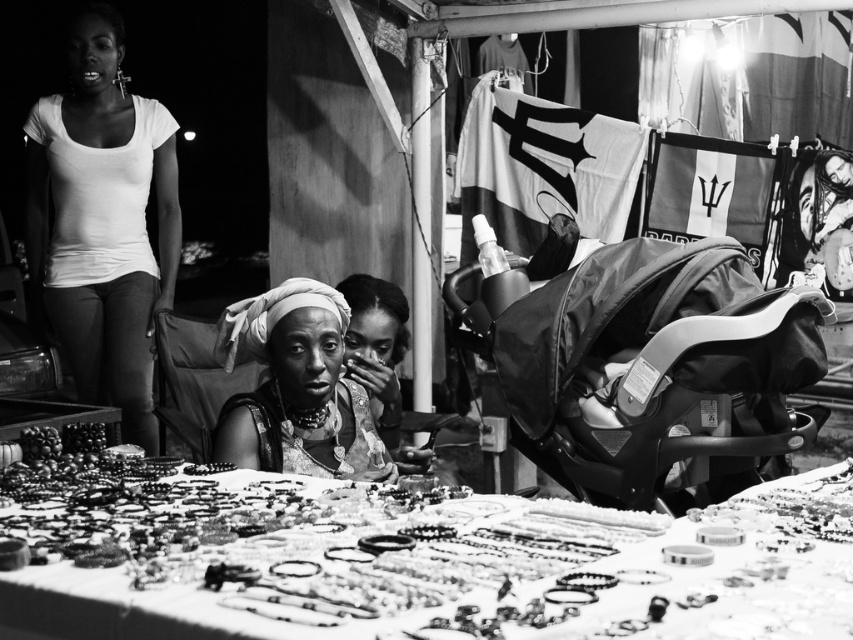
You are a customer at the night market and you see the matte gold necklace at center and the matte fabric headscarf at center. Which item is closer to you?

The matte gold necklace at center is closer to you because it is in front of the matte fabric headscarf at center.

You are a customer at the market and want to examine the jewelry displayed on the table. There is a specific point you noticed at coordinates point [297,388]. What type of jewelry is located at that point?

The point [297,388] is on matte gold necklace at center.